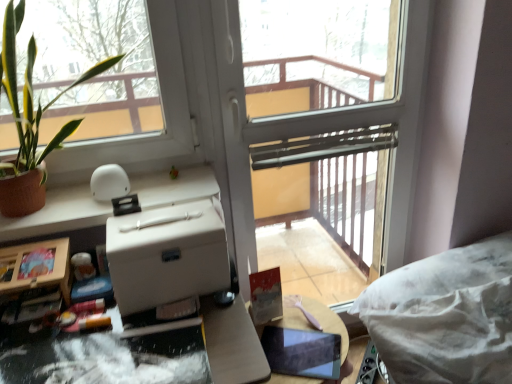
This screenshot has height=384, width=512. I want to click on vacant area situated below green leafy plant at left (from a real-world perspective), so click(64, 204).